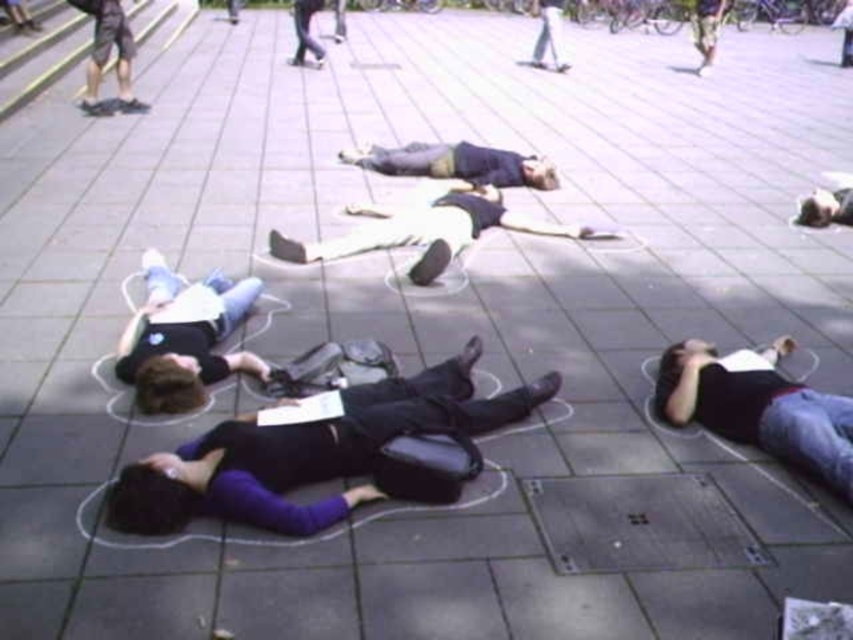
Question: Which object is farther from the camera taking this photo?

Choices:
 (A) purple matte shirt at center
 (B) black matte shirt at center

Answer: (B)

Question: Does dark blue jeans at lower right appear over light beige pants at center?

Choices:
 (A) yes
 (B) no

Answer: (B)

Question: Does light beige pants at center have a smaller size compared to dark blue jeans at center?

Choices:
 (A) no
 (B) yes

Answer: (A)

Question: Is black matte shirt at center wider than light beige pants at center?

Choices:
 (A) yes
 (B) no

Answer: (B)

Question: Among these points, which one is nearest to the camera?

Choices:
 (A) (383, 156)
 (B) (125, 326)
 (C) (331, 454)
 (D) (463, 241)

Answer: (C)

Question: Which object appears closest to the camera in this image?

Choices:
 (A) light beige pants at center
 (B) black matte shirt at center
 (C) purple matte shirt at center
 (D) dark blue jeans at lower right

Answer: (C)